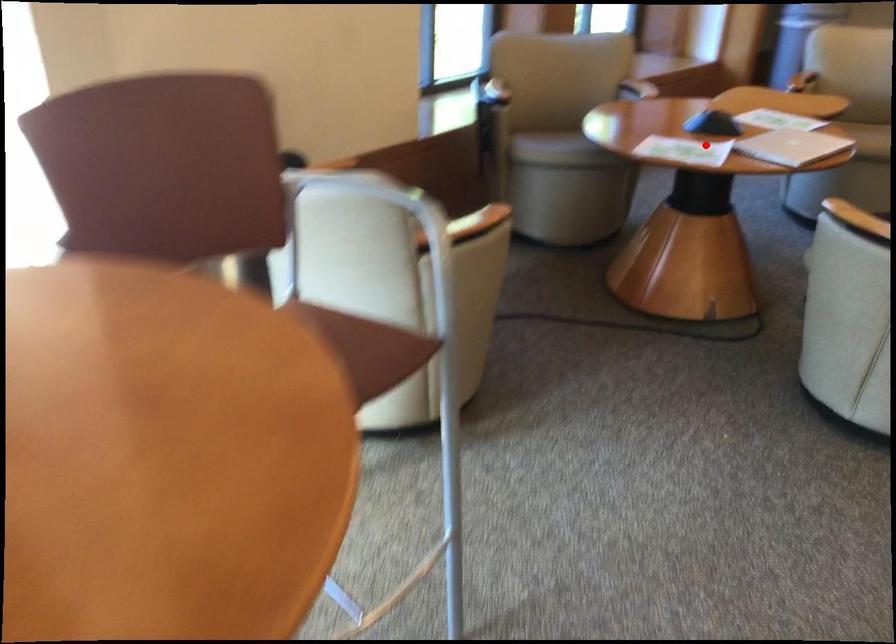
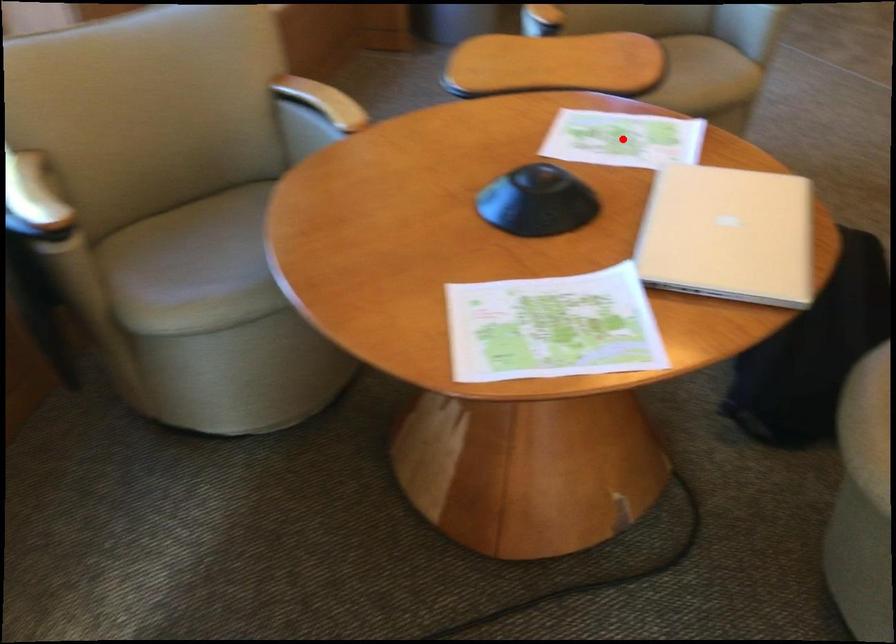
I am providing you with two images of the same scene from different viewpoints. A red point is marked on the first image and another point is marked on the second image. Does the point marked in image1 correspond to the same location as the one in image2?

No